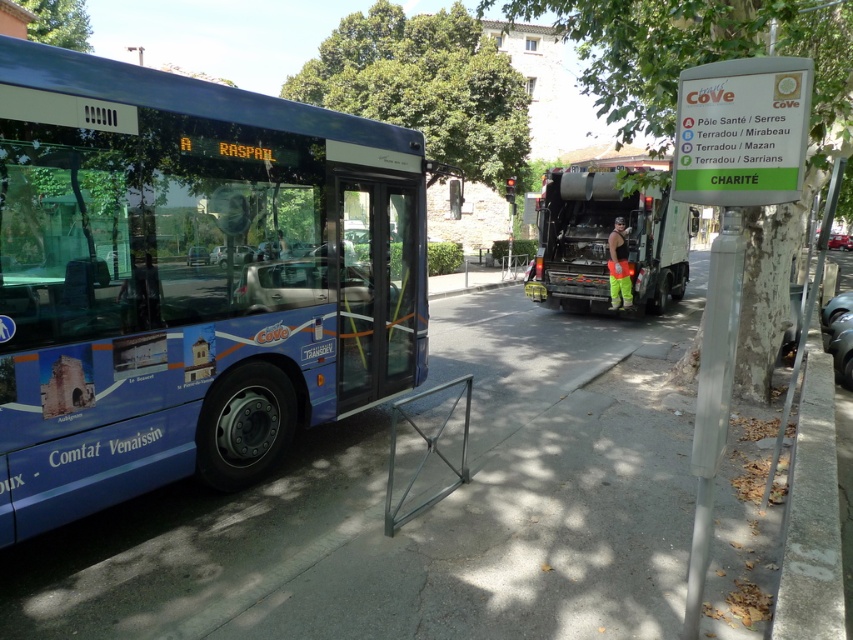
Question: Does blue painted bus at center have a lesser width compared to reflective orange vest at center?

Choices:
 (A) no
 (B) yes

Answer: (A)

Question: Which of the following is the closest to the observer?

Choices:
 (A) (468, 572)
 (B) (189, 419)
 (C) (659, 228)
 (D) (779, 100)

Answer: (D)

Question: Which point is closer to the camera?

Choices:
 (A) reflective orange vest at center
 (B) gray concrete curb at lower right
 (C) white plastic sign at upper right

Answer: (C)

Question: Can you confirm if blue metallic bus at left is positioned above gray concrete pavement at center?

Choices:
 (A) no
 (B) yes

Answer: (B)

Question: Does blue metallic bus at left have a smaller size compared to gray concrete pavement at center?

Choices:
 (A) no
 (B) yes

Answer: (B)

Question: Which point is farther to the camera?

Choices:
 (A) gray concrete pavement at center
 (B) blue metallic bus at left
 (C) blue painted bus at center
 (D) white plastic sign at upper right

Answer: (C)